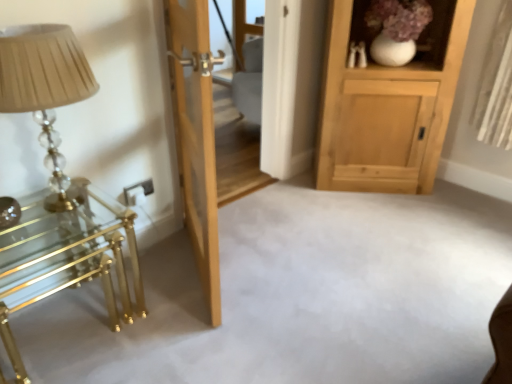
Question: From a real-world perspective, is translucent glass table lamp at left under natural wood door at center?

Choices:
 (A) no
 (B) yes

Answer: (A)

Question: Does translucent glass table lamp at left have a larger size compared to natural wood door at center?

Choices:
 (A) no
 (B) yes

Answer: (A)

Question: Is translucent glass table lamp at left wider than natural wood door at center?

Choices:
 (A) yes
 (B) no

Answer: (A)

Question: Can you confirm if translucent glass table lamp at left is shorter than natural wood door at center?

Choices:
 (A) no
 (B) yes

Answer: (B)

Question: Is the depth of translucent glass table lamp at left greater than that of natural wood door at center?

Choices:
 (A) yes
 (B) no

Answer: (B)

Question: From a real-world perspective, is translucent glass table lamp at left above or below natural wood door at center?

Choices:
 (A) above
 (B) below

Answer: (A)

Question: Does point (77, 81) appear closer or farther from the camera than point (207, 288)?

Choices:
 (A) farther
 (B) closer

Answer: (B)

Question: Would you say translucent glass table lamp at left is to the left or to the right of natural wood door at center in the picture?

Choices:
 (A) left
 (B) right

Answer: (A)

Question: From their relative heights in the image, would you say translucent glass table lamp at left is taller or shorter than natural wood door at center?

Choices:
 (A) tall
 (B) short

Answer: (B)

Question: Considering the positions of transparent glass door at center and white ceramic vase at upper right in the image, is transparent glass door at center wider or thinner than white ceramic vase at upper right?

Choices:
 (A) thin
 (B) wide

Answer: (A)

Question: Would you say transparent glass door at center is to the left or to the right of white ceramic vase at upper right in the picture?

Choices:
 (A) right
 (B) left

Answer: (B)

Question: Is transparent glass door at center inside the boundaries of white ceramic vase at upper right, or outside?

Choices:
 (A) outside
 (B) inside

Answer: (A)

Question: Is transparent glass door at center in front of or behind white ceramic vase at upper right in the image?

Choices:
 (A) behind
 (B) front

Answer: (A)

Question: Is natural wood door at center in front of or behind white ceramic vase at upper right in the image?

Choices:
 (A) front
 (B) behind

Answer: (A)

Question: Is natural wood door at center to the left or to the right of white ceramic vase at upper right in the image?

Choices:
 (A) right
 (B) left

Answer: (B)